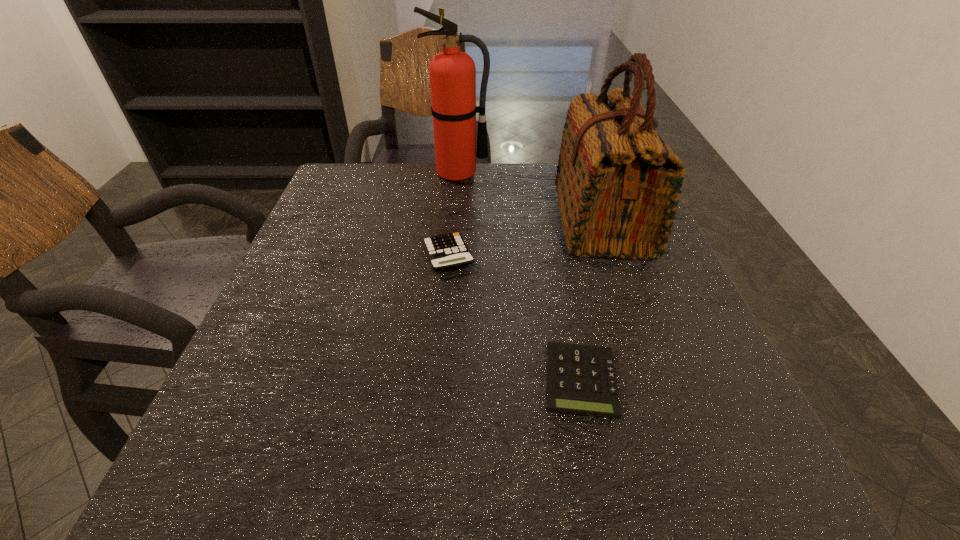
Find the location of a particular element. The height and width of the screenshot is (540, 960). fire extinguisher is located at coordinates (452, 73).

Locate an element on the screen. The height and width of the screenshot is (540, 960). shopping bag is located at coordinates (618, 183).

I want to click on the taller calculator, so click(444, 251).

Find the location of `the left calculator`. the left calculator is located at coordinates (444, 251).

Find the location of a particular element. This screenshot has width=960, height=540. the shorter calculator is located at coordinates (581, 379).

This screenshot has height=540, width=960. I want to click on the shortest object, so click(581, 379).

I want to click on blank space located 0.080m at the nozzle of the farthest object, so click(456, 199).

The width and height of the screenshot is (960, 540). Find the location of `vacant area located 0.320m on the open handle side of the shopping bag`. vacant area located 0.320m on the open handle side of the shopping bag is located at coordinates (421, 220).

Image resolution: width=960 pixels, height=540 pixels. Find the location of `free spot located 0.370m on the open handle side of the shopping bag`. free spot located 0.370m on the open handle side of the shopping bag is located at coordinates (400, 220).

Where is `vacant space located 0.360m on the open handle side of the shopping bag`? The image size is (960, 540). vacant space located 0.360m on the open handle side of the shopping bag is located at coordinates (404, 220).